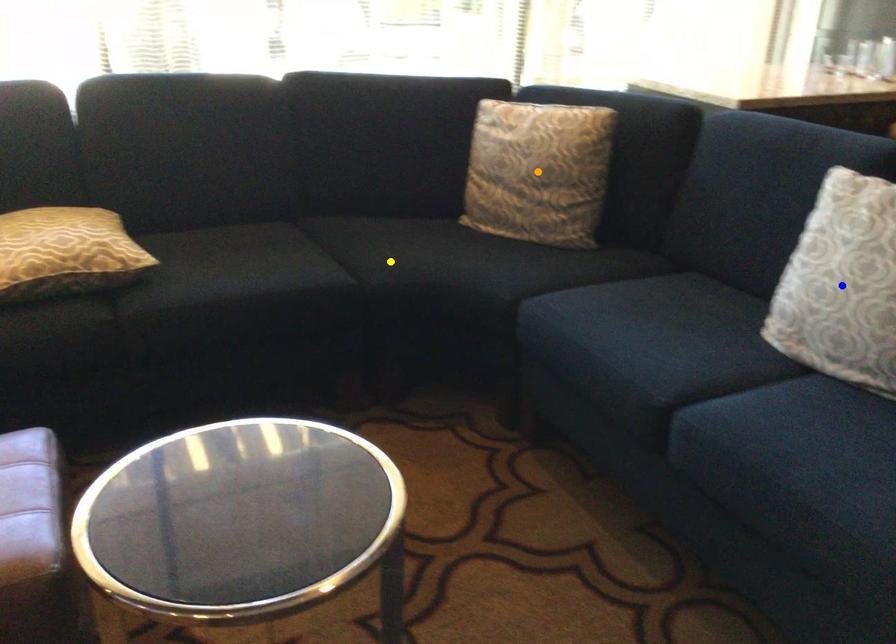
Order these from nearest to farthest:
- orange point
- yellow point
- blue point

blue point, yellow point, orange point